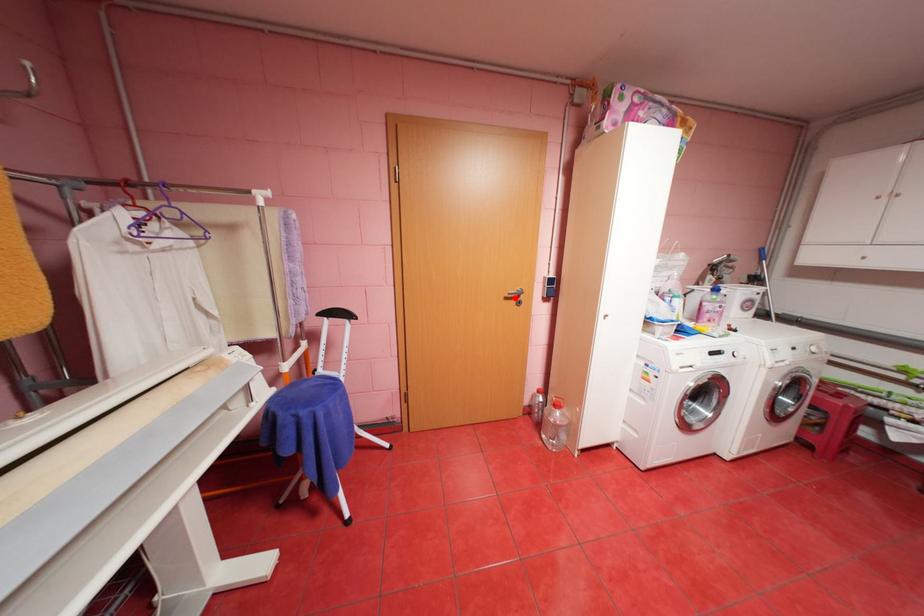
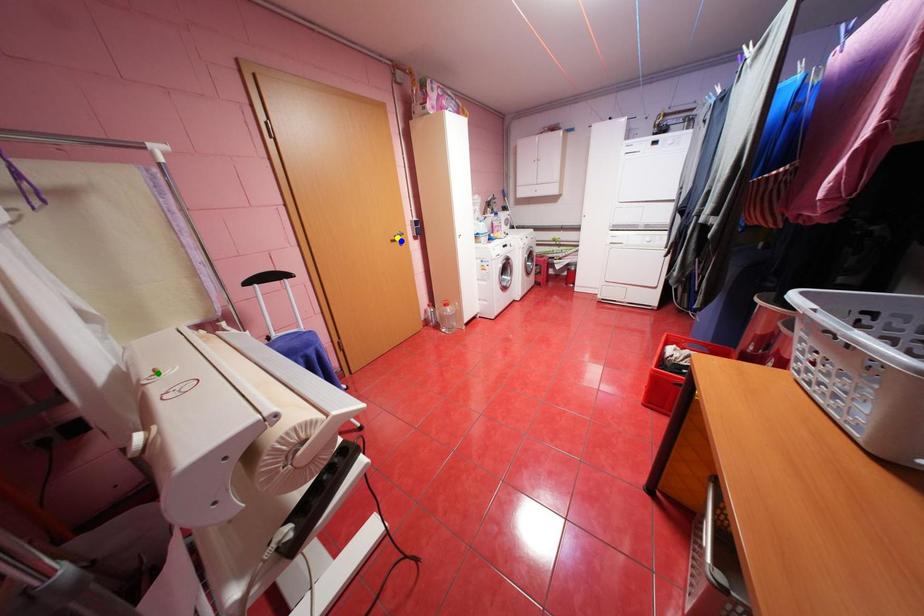
Question: I am providing you with two images of the same scene from different viewpoints. A red point is marked on the first image. You are given multiple points on the second image. Which spot in image 2 lines up with the point in image 1?

Choices:
 (A) yellow point
 (B) green point
 (C) blue point

Answer: (C)